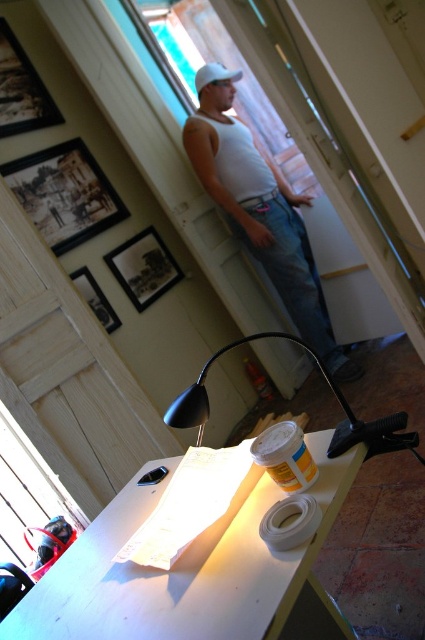
Question: Which of the following is the farthest from the observer?

Choices:
 (A) white matte baseball hat at upper center
 (B) matte black picture frame at upper center
 (C) white matte table at lower center
 (D) white matte tape at lower center

Answer: (A)

Question: Based on their relative distances, which object is farther from the white matte table at lower center?

Choices:
 (A) wooden framed picture at upper left
 (B) wooden photo frame at upper left
 (C) matte black picture frame at upper center

Answer: (B)

Question: Is wooden photo frame at upper left wider than white matte tape at lower center?

Choices:
 (A) no
 (B) yes

Answer: (B)

Question: Is white matte table at lower center below white matte baseball hat at upper center?

Choices:
 (A) no
 (B) yes

Answer: (B)

Question: Where is white matte table at lower center located in relation to matte black picture frame at upper center in the image?

Choices:
 (A) left
 (B) right

Answer: (B)

Question: Which point is closer to the camera taking this photo?

Choices:
 (A) pyautogui.click(x=16, y=186)
 (B) pyautogui.click(x=51, y=99)
 (C) pyautogui.click(x=201, y=68)

Answer: (A)